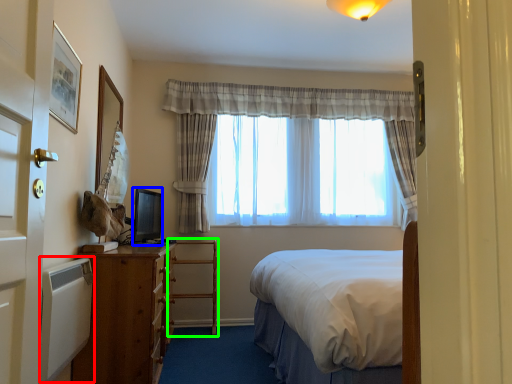
Question: Considering the real-world distances, which object is farthest from radiator (highlighted by a red box)? television (highlighted by a blue box) or armchair (highlighted by a green box)?

Choices:
 (A) television
 (B) armchair

Answer: (B)